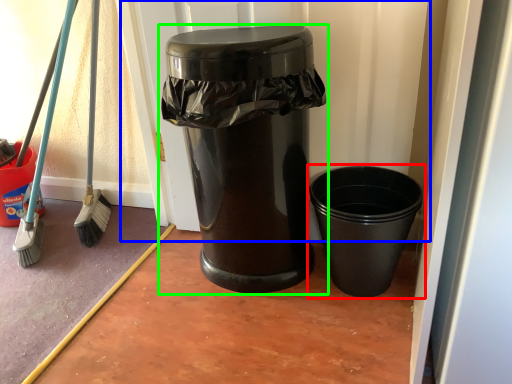
Question: Which is farther away from waste container (highlighted by a red box)? screen door (highlighted by a blue box) or waste container (highlighted by a green box)?

Choices:
 (A) screen door
 (B) waste container

Answer: (A)